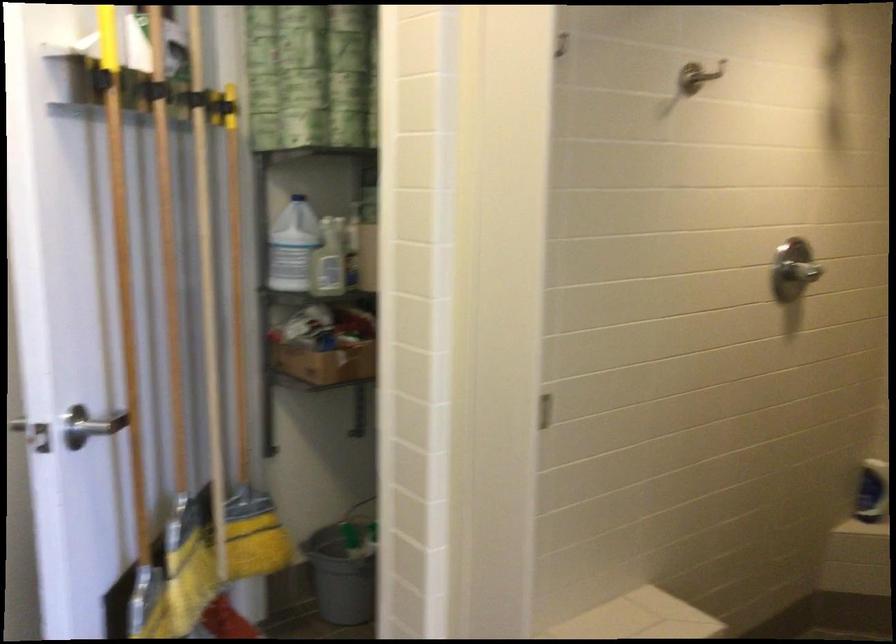
In order to click on silver shower handle in this screenshot , I will do `click(793, 270)`.